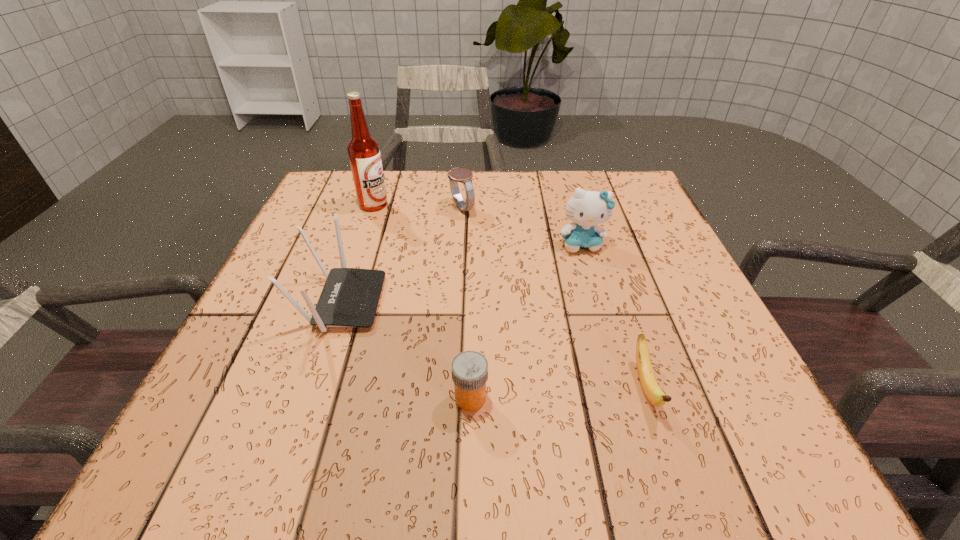
What are the coordinates of `alcohol` in the screenshot? It's located at (363, 150).

This screenshot has height=540, width=960. I want to click on the fourth nearest object, so click(x=587, y=209).

Locate an element on the screen. the fourth farthest object is located at coordinates (350, 296).

You are a GUI agent. You are given a task and a screenshot of the screen. Output one action in this format:
    pyautogui.click(x=<x>, y=<y>)
    Task: Click on the watch
    This screenshot has height=540, width=960.
    Given the screenshot: What is the action you would take?
    pyautogui.click(x=462, y=175)

Where is `medicine`? This screenshot has width=960, height=540. medicine is located at coordinates (469, 369).

Identify the location of the shortest object. The image size is (960, 540). (655, 395).

You are a GUI agent. You are given a task and a screenshot of the screen. Output one action in this format:
    pyautogui.click(x=<x>, y=<y>)
    Task: Click on the free location located on the label side of the alcohol
    The width and height of the screenshot is (960, 540).
    Given the screenshot: What is the action you would take?
    click(x=492, y=205)

This screenshot has height=540, width=960. What are the coordinates of `vacant space situated on the face of the kitten` in the screenshot? It's located at (630, 411).

At what (x,y) coordinates should I click in order to perform the action: click on vacant region located 0.320m on the front-facing side of the router. Please return your answer as a coordinate pair (x, y). Image resolution: width=960 pixels, height=540 pixels. Looking at the image, I should click on coord(543,302).

In order to click on vacant space located on the front of the fourth tallest object in this screenshot , I will do `click(457, 302)`.